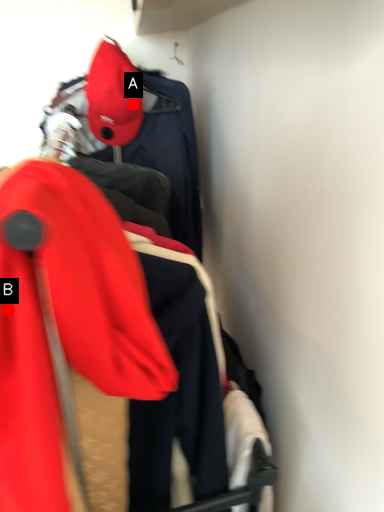
Question: Two points are circled on the image, labeled by A and B beside each circle. Which point is farther from the camera taking this photo?

Choices:
 (A) A is further
 (B) B is further

Answer: (A)